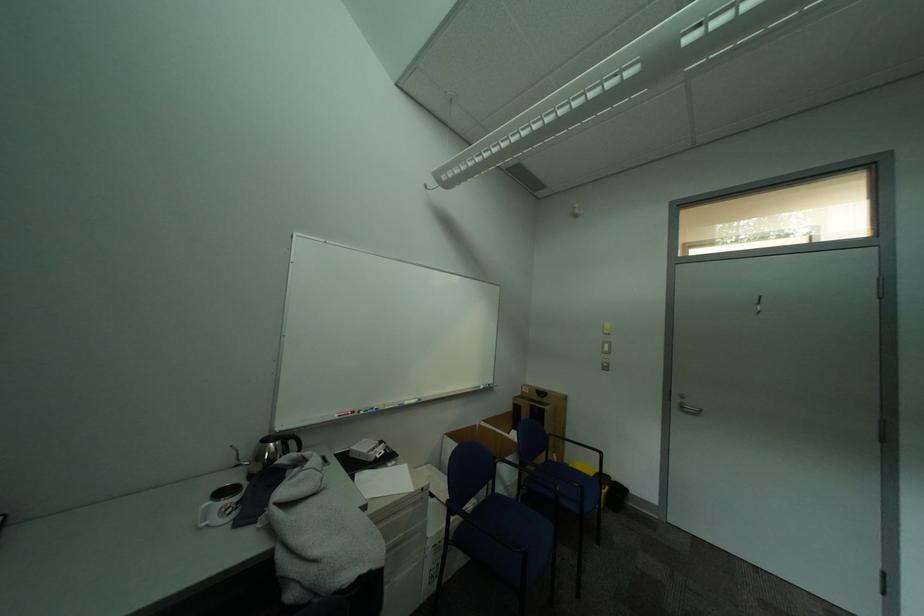
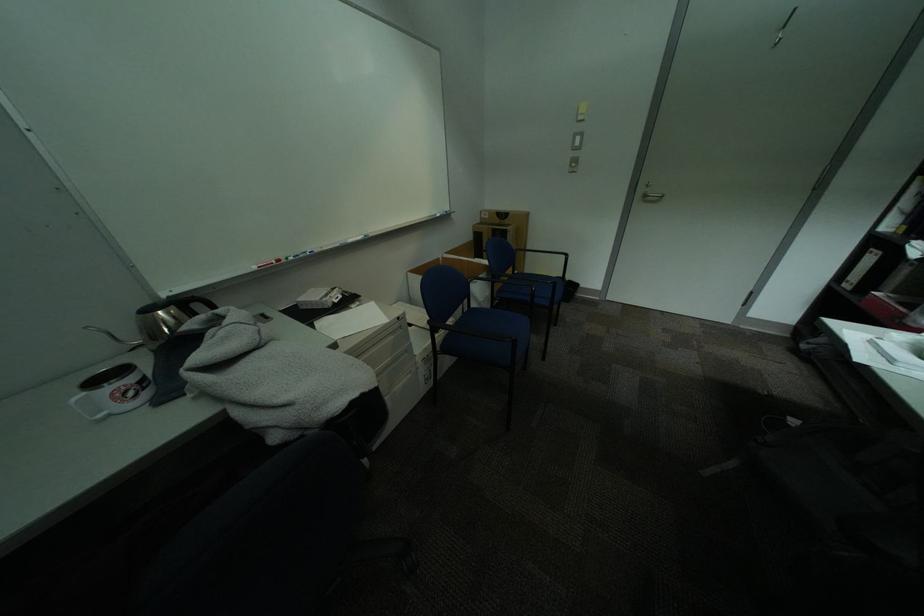
Find the pixel in the second image that matches (450,533) in the first image.

(435, 350)